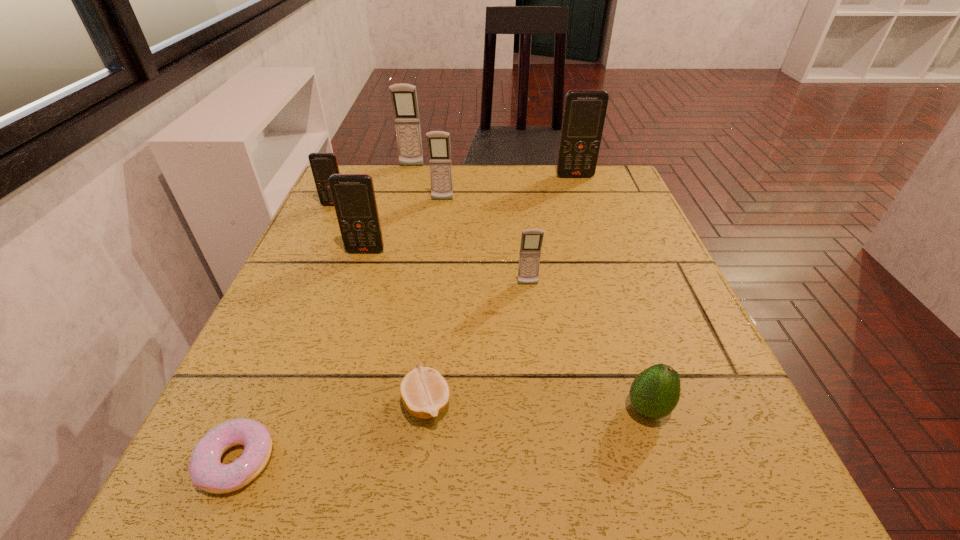
Where is `object present at the near left corner`? The height and width of the screenshot is (540, 960). object present at the near left corner is located at coordinates (206, 471).

This screenshot has height=540, width=960. In order to click on object that is positioned at the far right corner in this screenshot , I will do `click(584, 113)`.

What are the coordinates of `blank space at the far edge` in the screenshot? It's located at 499,209.

This screenshot has height=540, width=960. What are the coordinates of `vacant area at the near edge` in the screenshot? It's located at (482, 450).

The image size is (960, 540). I want to click on vacant space at the left edge of the desktop, so click(345, 298).

The width and height of the screenshot is (960, 540). In order to click on vacant space at the right edge of the desktop in this screenshot , I will do `click(613, 241)`.

At what (x,y) coordinates should I click in order to perform the action: click on free spot between the doughnut and the second nearest orange cellular telephone. Please return your answer as a coordinate pair (x, y). This screenshot has width=960, height=540. Looking at the image, I should click on (285, 333).

Where is `blank region between the doughnut and the farthest cellular telephone`? blank region between the doughnut and the farthest cellular telephone is located at coordinates (324, 313).

What are the coordinates of `vacant point located between the fourth nearest object and the doughnut` in the screenshot? It's located at (382, 373).

Where is `free space between the doughnut and the rightmost gray cellular telephone`? The image size is (960, 540). free space between the doughnut and the rightmost gray cellular telephone is located at coordinates (382, 373).